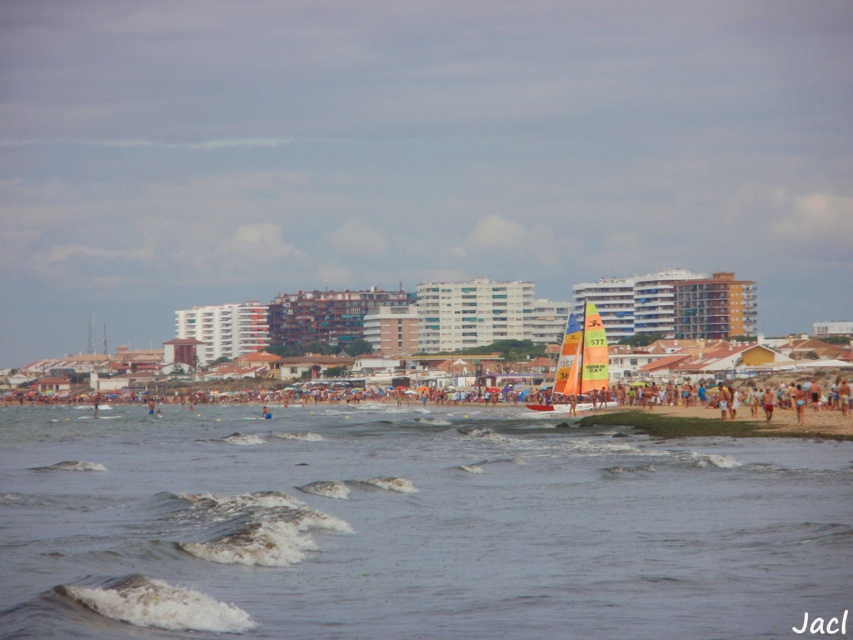
Question: Can you confirm if orange fabric sailboat at center is positioned above blue fabric shorts at lower right?

Choices:
 (A) no
 (B) yes

Answer: (A)

Question: Which of the following is the closest to the observer?

Choices:
 (A) clear water at lower center
 (B) multicolored sailboat at center
 (C) orange fabric sailboat at center

Answer: (A)

Question: Which of the following is the farthest from the observer?

Choices:
 (A) (572, 388)
 (B) (808, 404)
 (C) (793, 394)
 (D) (310, 486)

Answer: (A)

Question: Is orange fabric sailboat at center thinner than multicolored sailboat at center?

Choices:
 (A) no
 (B) yes

Answer: (A)

Question: Where is orange fabric sailboat at center located in relation to blue fabric shorts at lower right in the image?

Choices:
 (A) below
 (B) above

Answer: (A)

Question: Which point is closer to the camera taking this photo?

Choices:
 (A) (543, 410)
 (B) (799, 387)
 (C) (601, 353)
 (D) (416, 419)

Answer: (A)